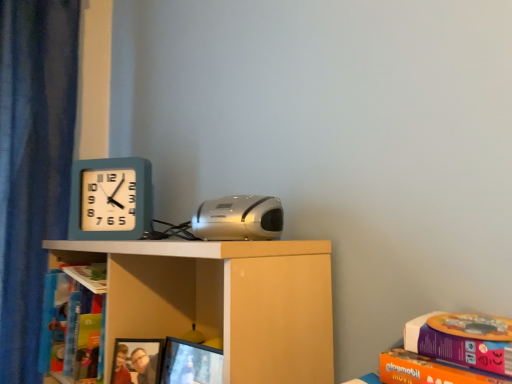
Question: Is silver metallic stereo at center in contact with white matte shelf at center?

Choices:
 (A) no
 (B) yes

Answer: (A)

Question: Does silver metallic stereo at center contain white matte shelf at center?

Choices:
 (A) yes
 (B) no

Answer: (B)

Question: Can you confirm if silver metallic stereo at center is thinner than white matte shelf at center?

Choices:
 (A) no
 (B) yes

Answer: (B)

Question: Is silver metallic stereo at center facing towards white matte shelf at center?

Choices:
 (A) yes
 (B) no

Answer: (B)

Question: Does silver metallic stereo at center have a greater height compared to white matte shelf at center?

Choices:
 (A) no
 (B) yes

Answer: (A)

Question: In the image, is silver metallic stereo at center positioned in front of or behind matte black monitor at lower center?

Choices:
 (A) front
 (B) behind

Answer: (A)

Question: From the image's perspective, is silver metallic stereo at center located above or below matte black monitor at lower center?

Choices:
 (A) below
 (B) above

Answer: (B)

Question: Based on their sizes in the image, would you say silver metallic stereo at center is bigger or smaller than matte black monitor at lower center?

Choices:
 (A) small
 (B) big

Answer: (B)

Question: From a real-world perspective, is silver metallic stereo at center above or below matte black monitor at lower center?

Choices:
 (A) below
 (B) above

Answer: (B)

Question: In terms of height, does matte plastic picture frame at lower center look taller or shorter compared to silver metallic stereo at center?

Choices:
 (A) short
 (B) tall

Answer: (B)

Question: From a real-world perspective, is matte plastic picture frame at lower center above or below silver metallic stereo at center?

Choices:
 (A) below
 (B) above

Answer: (A)

Question: In the image, is matte plastic picture frame at lower center positioned in front of or behind silver metallic stereo at center?

Choices:
 (A) behind
 (B) front

Answer: (A)

Question: Based on their positions, is matte plastic picture frame at lower center located to the left or right of silver metallic stereo at center?

Choices:
 (A) right
 (B) left

Answer: (B)

Question: From a real-world perspective, is matte plastic picture frame at lower center physically located above or below hardcover book at left, which ranks as the second book in back-to-front order?

Choices:
 (A) above
 (B) below

Answer: (B)

Question: Considering the positions of matte plastic picture frame at lower center and hardcover book at left, the second book in the left-to-right sequence, in the image, is matte plastic picture frame at lower center bigger or smaller than hardcover book at left, the second book in the left-to-right sequence,?

Choices:
 (A) small
 (B) big

Answer: (A)